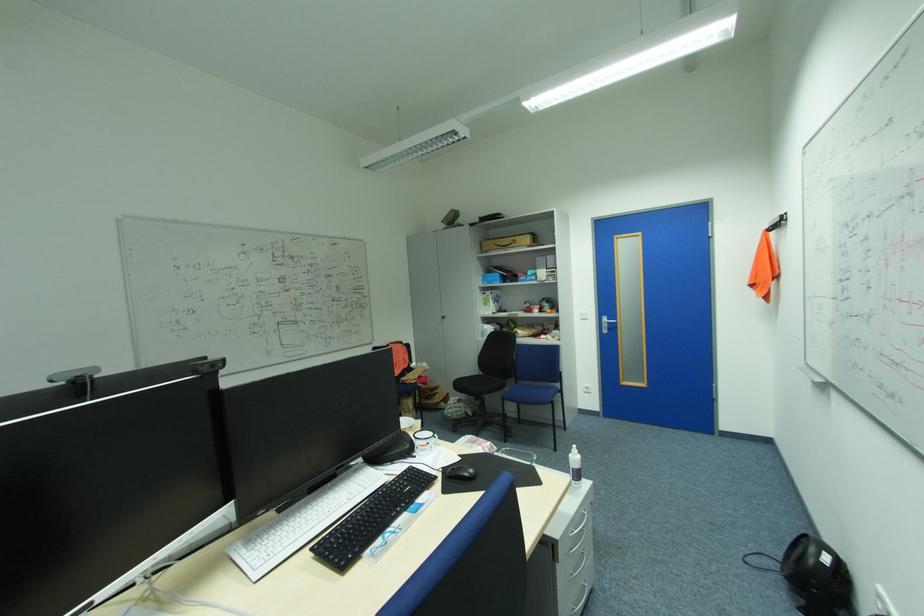
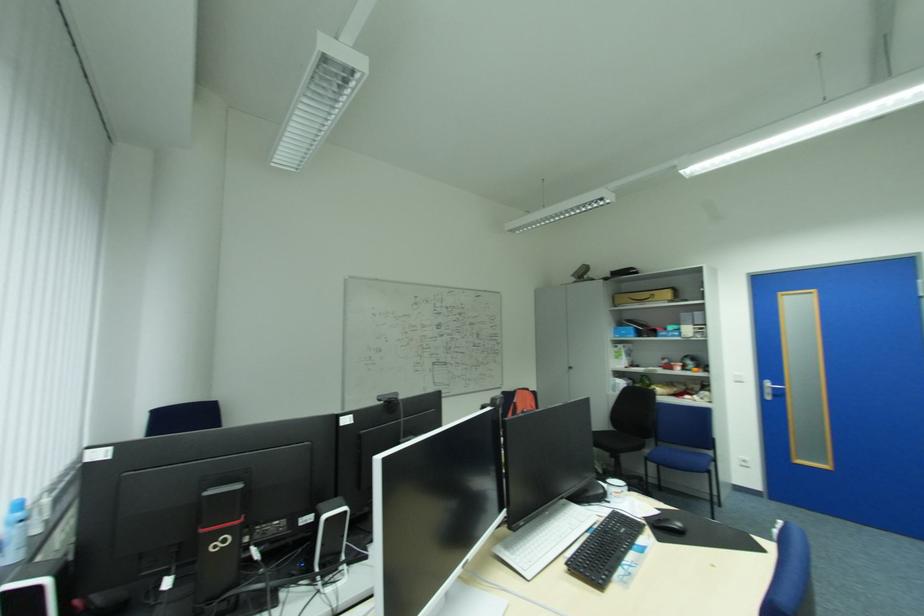
In the second image, find the point that corresponds to [612,318] in the first image.

(774, 384)